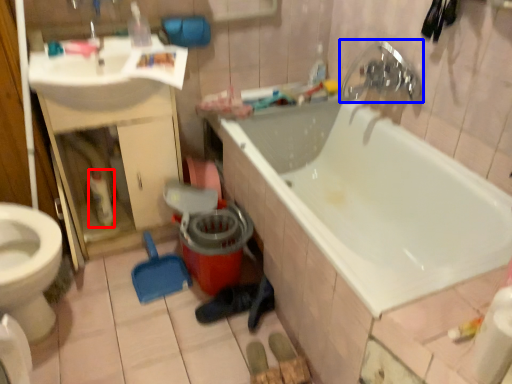
Question: Among these objects, which one is nearest to the camera, cleaning product (highlighted by a red box) or tap (highlighted by a blue box)?

Choices:
 (A) cleaning product
 (B) tap

Answer: (B)